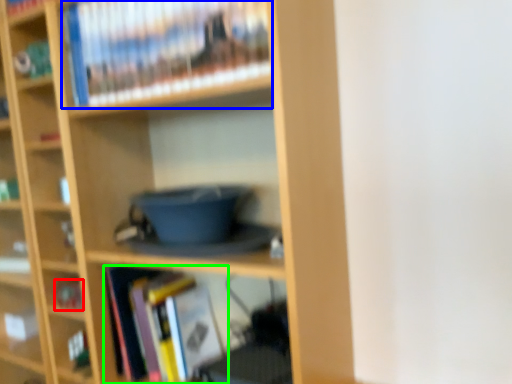
Question: Which object is the farthest from book (highlighted by a red box)? Choose among these: book (highlighted by a blue box) or book (highlighted by a green box).

Choices:
 (A) book
 (B) book

Answer: (A)